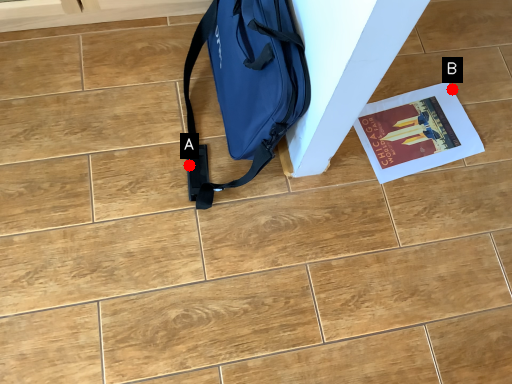
Question: Two points are circled on the image, labeled by A and B beside each circle. Among these points, which one is nearest to the camera?

Choices:
 (A) A is closer
 (B) B is closer

Answer: (A)